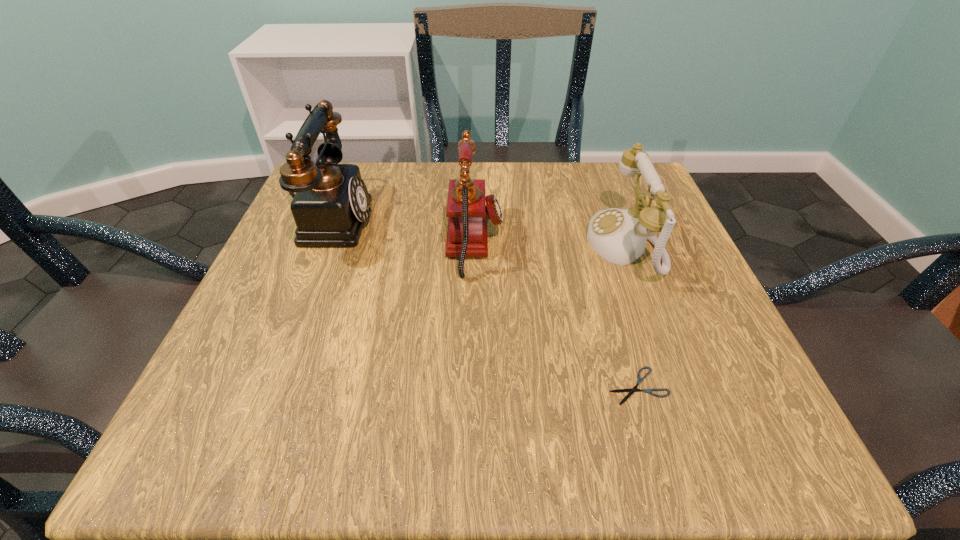
Find the location of a particular element. This screenshot has width=960, height=540. free space located on the dial of the rightmost telephone is located at coordinates (421, 244).

Where is `free spot located on the left of the nearest object`? This screenshot has height=540, width=960. free spot located on the left of the nearest object is located at coordinates (544, 386).

I want to click on object that is positioned at the near edge, so click(639, 380).

Identify the location of object present at the left edge. The width and height of the screenshot is (960, 540). (330, 207).

Where is `telephone that is at the right edge`? Image resolution: width=960 pixels, height=540 pixels. telephone that is at the right edge is located at coordinates (619, 236).

Where is `shears that is at the right edge`? This screenshot has height=540, width=960. shears that is at the right edge is located at coordinates (639, 380).

Where is `object that is at the far left corner`? This screenshot has height=540, width=960. object that is at the far left corner is located at coordinates coord(330,207).

At what (x,y) coordinates should I click in order to perform the action: click on object located at the far right corner. Please return your answer as a coordinate pair (x, y). The image size is (960, 540). Looking at the image, I should click on (619, 236).

You are a GUI agent. You are given a task and a screenshot of the screen. Output one action in this format:
    pyautogui.click(x=<x>, y=<y>)
    Task: Click on the object located in the near right corner section of the desktop
    The height and width of the screenshot is (540, 960).
    Given the screenshot: What is the action you would take?
    pyautogui.click(x=639, y=380)

The height and width of the screenshot is (540, 960). In the image, there is a desktop. Identify the location of vacant space at the far edge. (507, 207).